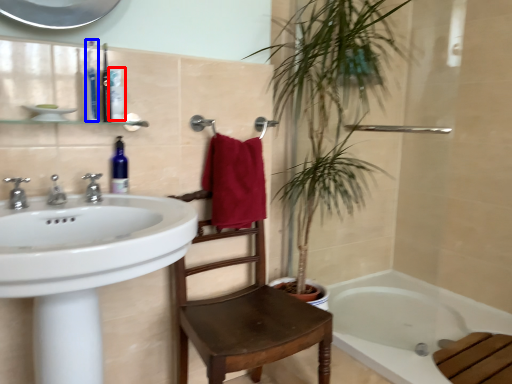
Question: Which object appears farthest to the camera in this image, toiletry (highlighted by a red box) or toiletry (highlighted by a blue box)?

Choices:
 (A) toiletry
 (B) toiletry

Answer: (A)